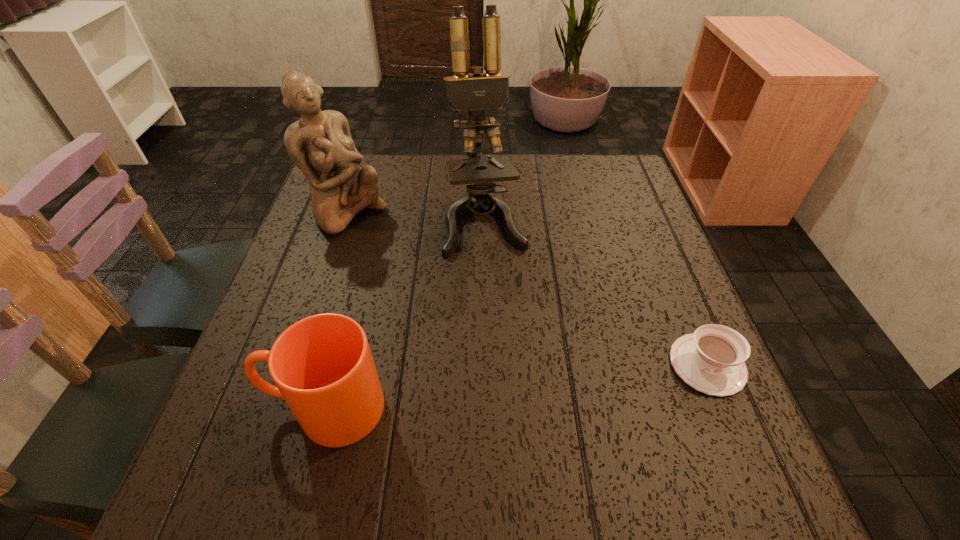
The width and height of the screenshot is (960, 540). Identify the location of vacant space that satisfies the following two spatial constraints: 1. on the front side of the teacup; 2. on the handle side of the third object from left to right. (487, 364).